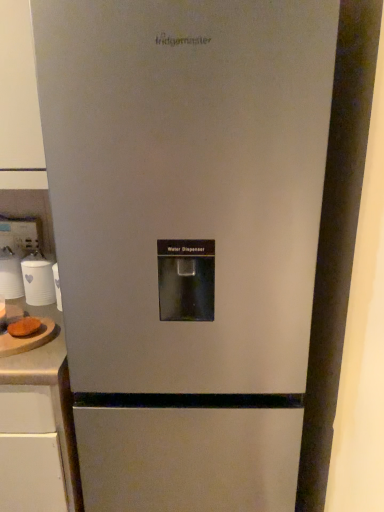
You are a GUI agent. You are given a task and a screenshot of the screen. Output one action in this format:
    pyautogui.click(x=<x>, y=<y>)
    Task: Click on the brown fuzzy bread at left
    
    Given the screenshot: What is the action you would take?
    pyautogui.click(x=24, y=327)

You are a GUI agent. You are given a task and a screenshot of the screen. Output one action in this format:
    pyautogui.click(x=<x>, y=<y>)
    Task: Click on the white glossy cups at left, marked as the 2th appliance in a right-to-left arrangement
    
    Given the screenshot: What is the action you would take?
    pyautogui.click(x=10, y=275)

From a real-world perspective, between white laminate counter at lower left, marked as the 1th counter top in a bottom-to-top arrangement, and white matte cup at left, positioned as the 2th appliance in left-to-right order, who is vertically lower?

From a 3D spatial view, white laminate counter at lower left, marked as the 1th counter top in a bottom-to-top arrangement, is below.

Is white laminate counter at lower left, marked as the 1th counter top in a bottom-to-top arrangement, directly adjacent to white matte cup at left, which is the first appliance from right to left?

No, white laminate counter at lower left, marked as the 1th counter top in a bottom-to-top arrangement, is not touching white matte cup at left, which is the first appliance from right to left.

Is point (21, 481) closer or farther from the camera than point (25, 295)?

Point (21, 481) appears to be closer to the viewer than point (25, 295).

Locate an element on the screen. This screenshot has width=384, height=512. the 1st appliance positioned above the white laminate counter at lower left, which ranks as the 2th counter top in top-to-bottom order (from the image's perspective) is located at coordinates (38, 280).

Is brown fuzzy bread at left not inside white laminate counter at lower left, marked as the 1th counter top in a bottom-to-top arrangement?

brown fuzzy bread at left is positioned outside white laminate counter at lower left, marked as the 1th counter top in a bottom-to-top arrangement.

Can you confirm if brown fuzzy bread at left is thinner than white laminate counter at lower left, which ranks as the 2th counter top in top-to-bottom order?

Indeed, brown fuzzy bread at left has a lesser width compared to white laminate counter at lower left, which ranks as the 2th counter top in top-to-bottom order.

Between brown fuzzy bread at left and white laminate counter at lower left, which ranks as the 2th counter top in top-to-bottom order, which one has smaller size?

With smaller size is brown fuzzy bread at left.

Is brown fuzzy bread at left far away from white laminate counter at lower left, marked as the 1th counter top in a bottom-to-top arrangement?

brown fuzzy bread at left is actually quite close to white laminate counter at lower left, marked as the 1th counter top in a bottom-to-top arrangement.

Can you confirm if white glossy cups at left, which is the 1th appliance in left-to-right order, is thinner than brown fuzzy bread at left?

Incorrect, the width of white glossy cups at left, which is the 1th appliance in left-to-right order, is not less than that of brown fuzzy bread at left.

From a real-world perspective, is white glossy cups at left, which is the 1th appliance in left-to-right order, over brown fuzzy bread at left?

Correct, in the physical world, white glossy cups at left, which is the 1th appliance in left-to-right order, is higher than brown fuzzy bread at left.

Is white glossy cups at left, which is the 1th appliance in left-to-right order, directly adjacent to brown fuzzy bread at left?

No, white glossy cups at left, which is the 1th appliance in left-to-right order, is not touching brown fuzzy bread at left.

Is wooden cutting board at left, which ranks as the first counter top in top-to-bottom order, not near white matte cup at left, positioned as the 2th appliance in left-to-right order?

Actually, wooden cutting board at left, which ranks as the first counter top in top-to-bottom order, and white matte cup at left, positioned as the 2th appliance in left-to-right order, are a little close together.

The height and width of the screenshot is (512, 384). In order to click on appliance that is the 1st object located behind the wooden cutting board at left, which ranks as the first counter top in top-to-bottom order in this screenshot , I will do `click(38, 280)`.

Which of these two, wooden cutting board at left, acting as the 2th counter top starting from the bottom, or white matte cup at left, positioned as the 2th appliance in left-to-right order, is smaller?

With smaller size is white matte cup at left, positioned as the 2th appliance in left-to-right order.

Is wooden cutting board at left, acting as the 2th counter top starting from the bottom, positioned behind white matte cup at left, positioned as the 2th appliance in left-to-right order?

That is False.

Is white laminate counter at lower left, which ranks as the 2th counter top in top-to-bottom order, positioned far away from wooden cutting board at left, acting as the 2th counter top starting from the bottom?

No, white laminate counter at lower left, which ranks as the 2th counter top in top-to-bottom order, is not far away from wooden cutting board at left, acting as the 2th counter top starting from the bottom.

Measure the distance between white laminate counter at lower left, which ranks as the 2th counter top in top-to-bottom order, and wooden cutting board at left, acting as the 2th counter top starting from the bottom.

white laminate counter at lower left, which ranks as the 2th counter top in top-to-bottom order, is 4.90 inches from wooden cutting board at left, acting as the 2th counter top starting from the bottom.

Do you think white laminate counter at lower left, marked as the 1th counter top in a bottom-to-top arrangement, is within wooden cutting board at left, acting as the 2th counter top starting from the bottom, or outside of it?

white laminate counter at lower left, marked as the 1th counter top in a bottom-to-top arrangement, cannot be found inside wooden cutting board at left, acting as the 2th counter top starting from the bottom.

Can you confirm if white laminate counter at lower left, which ranks as the 2th counter top in top-to-bottom order, is bigger than wooden cutting board at left, acting as the 2th counter top starting from the bottom?

Indeed, white laminate counter at lower left, which ranks as the 2th counter top in top-to-bottom order, has a larger size compared to wooden cutting board at left, acting as the 2th counter top starting from the bottom.

Based on the photo, can you confirm if white glossy cups at left, marked as the 2th appliance in a right-to-left arrangement, is smaller than wooden cutting board at left, which ranks as the first counter top in top-to-bottom order?

Yes, white glossy cups at left, marked as the 2th appliance in a right-to-left arrangement, is smaller than wooden cutting board at left, which ranks as the first counter top in top-to-bottom order.

Is white glossy cups at left, which is the 1th appliance in left-to-right order, looking in the opposite direction of wooden cutting board at left, which ranks as the first counter top in top-to-bottom order?

That's not correct — white glossy cups at left, which is the 1th appliance in left-to-right order, is not looking away from wooden cutting board at left, which ranks as the first counter top in top-to-bottom order.

From the image's perspective, is white glossy cups at left, which is the 1th appliance in left-to-right order, positioned above or below wooden cutting board at left, acting as the 2th counter top starting from the bottom?

Based on their image positions, white glossy cups at left, which is the 1th appliance in left-to-right order, is located above wooden cutting board at left, acting as the 2th counter top starting from the bottom.

In order to click on the 2nd appliance above the wooden cutting board at left, which ranks as the first counter top in top-to-bottom order (from a real-world perspective) in this screenshot , I will do `click(10, 275)`.

Considering the relative positions of white matte cup at left, which is the first appliance from right to left, and wooden cutting board at left, which ranks as the first counter top in top-to-bottom order, in the image provided, is white matte cup at left, which is the first appliance from right to left, in front of wooden cutting board at left, which ranks as the first counter top in top-to-bottom order,?

No, white matte cup at left, which is the first appliance from right to left, is further to the viewer.

Would you say white matte cup at left, which is the first appliance from right to left, is outside wooden cutting board at left, acting as the 2th counter top starting from the bottom?

That's correct, white matte cup at left, which is the first appliance from right to left, is outside of wooden cutting board at left, acting as the 2th counter top starting from the bottom.

Is point (51, 285) closer or farther from the camera than point (44, 380)?

Clearly, point (51, 285) is more distant from the camera than point (44, 380).

Which of these two, white matte cup at left, which is the first appliance from right to left, or wooden cutting board at left, acting as the 2th counter top starting from the bottom, stands shorter?

wooden cutting board at left, acting as the 2th counter top starting from the bottom.

At what (x,y) coordinates should I click in order to perform the action: click on counter top that is the 2nd object located below the white matte cup at left, which is the first appliance from right to left (from the image's perspective). Please return your answer as a coordinate pair (x, y). Image resolution: width=384 pixels, height=512 pixels. Looking at the image, I should click on (38, 426).

Identify the location of counter top that is the 2nd object to the left of the brown fuzzy bread at left, starting at the anchor. This screenshot has height=512, width=384. (38, 426).

Considering their positions, is white laminate counter at lower left, which ranks as the 2th counter top in top-to-bottom order, positioned closer to wooden cutting board at left, which ranks as the first counter top in top-to-bottom order, than brown fuzzy bread at left?

The object closer to wooden cutting board at left, which ranks as the first counter top in top-to-bottom order, is brown fuzzy bread at left.

Based on their spatial positions, is brown fuzzy bread at left or wooden cutting board at left, acting as the 2th counter top starting from the bottom, further from white matte cup at left, which is the first appliance from right to left?

brown fuzzy bread at left is further to white matte cup at left, which is the first appliance from right to left.

Estimate the real-world distances between objects in this image. Which object is further from white matte cup at left, positioned as the 2th appliance in left-to-right order, brown fuzzy bread at left or white laminate counter at lower left, marked as the 1th counter top in a bottom-to-top arrangement?

The object further to white matte cup at left, positioned as the 2th appliance in left-to-right order, is white laminate counter at lower left, marked as the 1th counter top in a bottom-to-top arrangement.

Which object lies further to the anchor point white laminate counter at lower left, which ranks as the 2th counter top in top-to-bottom order, white matte cup at left, positioned as the 2th appliance in left-to-right order, or wooden cutting board at left, acting as the 2th counter top starting from the bottom?

white matte cup at left, positioned as the 2th appliance in left-to-right order.

Considering their positions, is white laminate counter at lower left, which ranks as the 2th counter top in top-to-bottom order, positioned closer to white matte cup at left, which is the first appliance from right to left, than wooden cutting board at left, which ranks as the first counter top in top-to-bottom order?

Based on the image, wooden cutting board at left, which ranks as the first counter top in top-to-bottom order, appears to be nearer to white matte cup at left, which is the first appliance from right to left.

Considering their positions, is white glossy cups at left, marked as the 2th appliance in a right-to-left arrangement, positioned closer to white matte cup at left, positioned as the 2th appliance in left-to-right order, than brown fuzzy bread at left?

white glossy cups at left, marked as the 2th appliance in a right-to-left arrangement, lies closer to white matte cup at left, positioned as the 2th appliance in left-to-right order, than the other object.

Which object lies further to the anchor point brown fuzzy bread at left, white matte cup at left, positioned as the 2th appliance in left-to-right order, or white glossy cups at left, which is the 1th appliance in left-to-right order?

white glossy cups at left, which is the 1th appliance in left-to-right order.

Based on their spatial positions, is white glossy cups at left, marked as the 2th appliance in a right-to-left arrangement, or wooden cutting board at left, which ranks as the first counter top in top-to-bottom order, further from white matte cup at left, which is the first appliance from right to left?

The object further to white matte cup at left, which is the first appliance from right to left, is wooden cutting board at left, which ranks as the first counter top in top-to-bottom order.

You are a GUI agent. You are given a task and a screenshot of the screen. Output one action in this format:
    pyautogui.click(x=<x>, y=<y>)
    Task: Click on the counter top between brown fuzzy bread at left and white laminate counter at lower left, marked as the 1th counter top in a bottom-to-top arrangement, in the vertical direction
    The width and height of the screenshot is (384, 512).
    Given the screenshot: What is the action you would take?
    pyautogui.click(x=37, y=355)

Where is `appliance between wooden cutting board at left, acting as the 2th counter top starting from the bottom, and white glossy cups at left, which is the 1th appliance in left-to-right order, from front to back`? The width and height of the screenshot is (384, 512). appliance between wooden cutting board at left, acting as the 2th counter top starting from the bottom, and white glossy cups at left, which is the 1th appliance in left-to-right order, from front to back is located at coordinates (38, 280).

Find the location of a particular element. The image size is (384, 512). counter top that lies between white glossy cups at left, marked as the 2th appliance in a right-to-left arrangement, and white laminate counter at lower left, which ranks as the 2th counter top in top-to-bottom order, from top to bottom is located at coordinates (37, 355).

At what (x,y) coordinates should I click in order to perform the action: click on food between white matte cup at left, positioned as the 2th appliance in left-to-right order, and white laminate counter at lower left, marked as the 1th counter top in a bottom-to-top arrangement, vertically. Please return your answer as a coordinate pair (x, y). The width and height of the screenshot is (384, 512). Looking at the image, I should click on (24, 327).